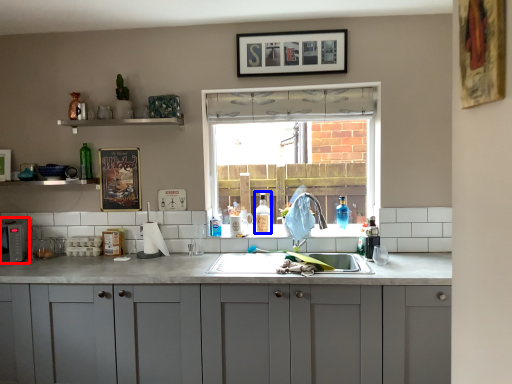
Question: Among these objects, which one is farthest to the camera, appliance (highlighted by a red box) or bottle (highlighted by a blue box)?

Choices:
 (A) appliance
 (B) bottle

Answer: (B)